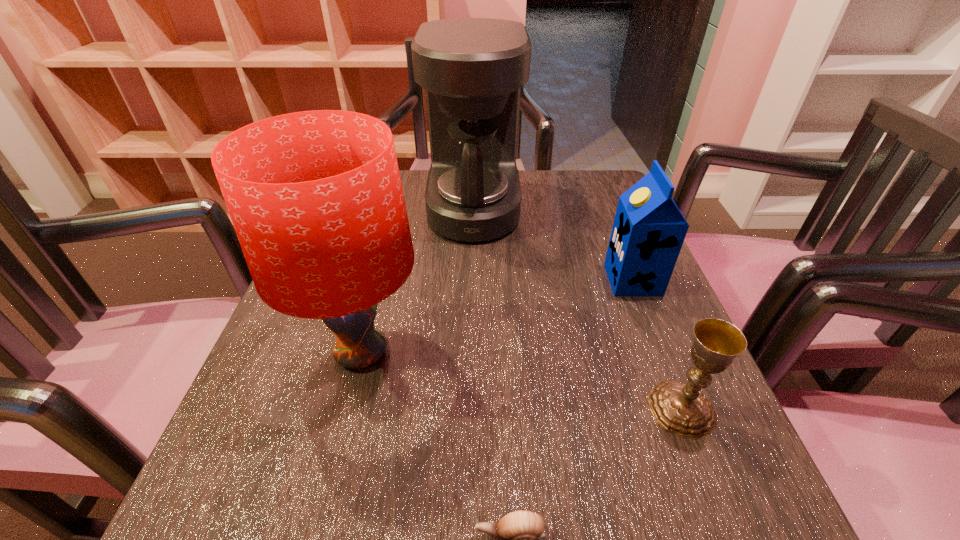
Locate an element on the screen. The height and width of the screenshot is (540, 960). coffee maker is located at coordinates [x=472, y=69].

Locate an element on the screen. lampshade is located at coordinates (315, 197).

Locate an element on the screen. The width and height of the screenshot is (960, 540). the second farthest object is located at coordinates (648, 232).

At what (x,y) coordinates should I click in order to perform the action: click on carton. Please return your answer as a coordinate pair (x, y). Looking at the image, I should click on (648, 232).

The width and height of the screenshot is (960, 540). What are the coordinates of `chalice` in the screenshot? It's located at (679, 408).

This screenshot has height=540, width=960. What are the coordinates of `vacant region located 0.250m on the button side of the farthest object` in the screenshot? It's located at [x=621, y=210].

This screenshot has height=540, width=960. In order to click on free region located 0.140m on the front-facing side of the lampshade in this screenshot , I will do `click(506, 353)`.

You are a GUI agent. You are given a task and a screenshot of the screen. Output one action in this format:
    pyautogui.click(x=<x>, y=<y>)
    Task: Click on the free spot located with the cap open on the third shortest object
    The height and width of the screenshot is (540, 960).
    Given the screenshot: What is the action you would take?
    pyautogui.click(x=500, y=280)

Where is `free space located with the cap open on the third shortest object`? This screenshot has width=960, height=540. free space located with the cap open on the third shortest object is located at coordinates (544, 280).

Where is `vacant region located 0.070m with the cap open on the third shortest object`? The image size is (960, 540). vacant region located 0.070m with the cap open on the third shortest object is located at coordinates (574, 280).